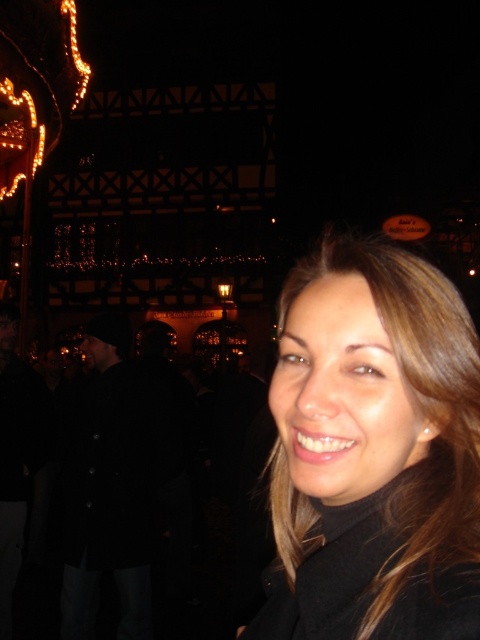
Question: Is black matte coat at center to the left of black wool coat at left from the viewer's perspective?

Choices:
 (A) no
 (B) yes

Answer: (A)

Question: Does black matte coat at center have a greater width compared to black wool coat at left?

Choices:
 (A) no
 (B) yes

Answer: (B)

Question: Which object appears closest to the camera in this image?

Choices:
 (A) black matte coat at center
 (B) black wool coat at left

Answer: (A)

Question: Is black matte coat at center positioned at the back of black wool coat at left?

Choices:
 (A) no
 (B) yes

Answer: (A)